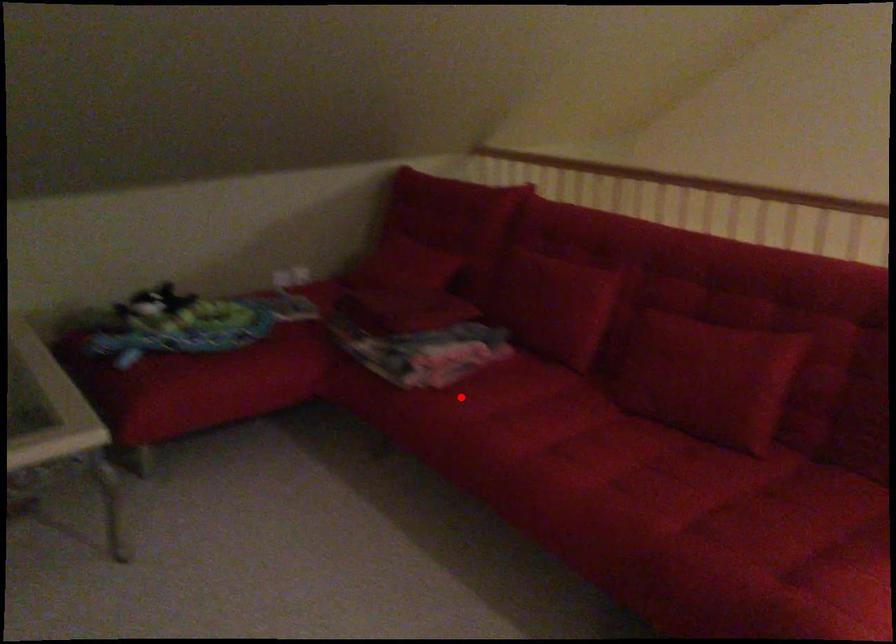
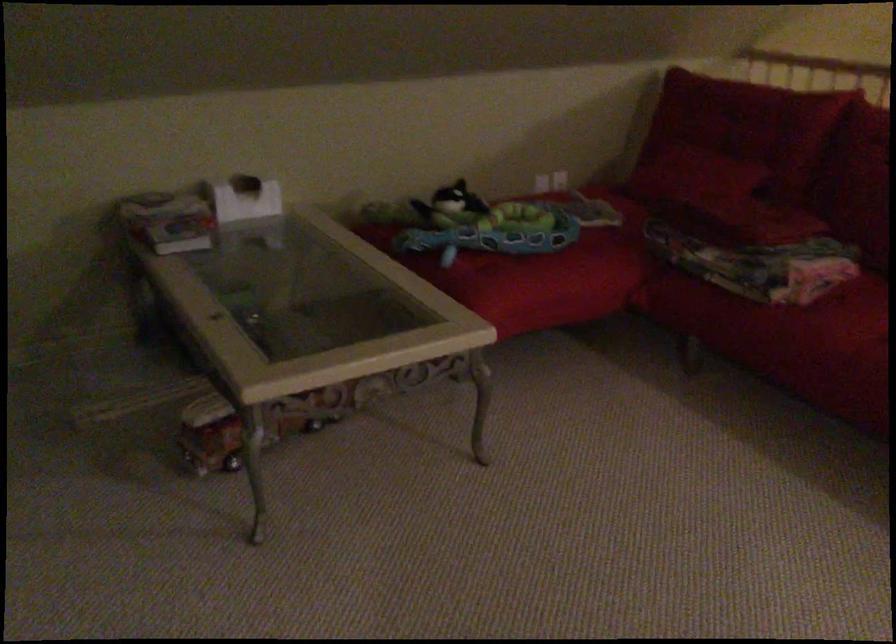
Find the pixel in the second image that matches the highlighted location in the first image.

(843, 317)